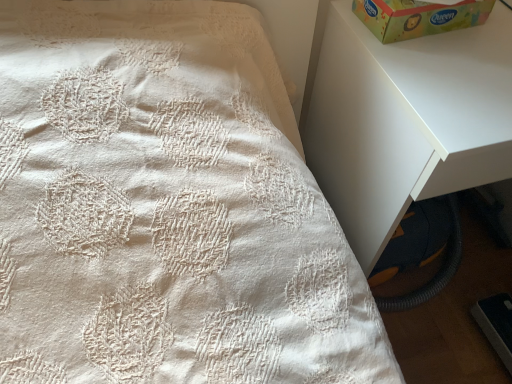
Question: Is green paperboard box at upper right with white matte nightstand at upper right?

Choices:
 (A) no
 (B) yes

Answer: (A)

Question: Is green paperboard box at upper right positioned beyond the bounds of white matte nightstand at upper right?

Choices:
 (A) no
 (B) yes

Answer: (B)

Question: From a real-world perspective, is green paperboard box at upper right located higher than white matte nightstand at upper right?

Choices:
 (A) no
 (B) yes

Answer: (B)

Question: Does green paperboard box at upper right appear on the right side of white matte nightstand at upper right?

Choices:
 (A) yes
 (B) no

Answer: (B)

Question: Considering the relative positions of green paperboard box at upper right and white matte nightstand at upper right in the image provided, is green paperboard box at upper right behind white matte nightstand at upper right?

Choices:
 (A) yes
 (B) no

Answer: (A)

Question: Does green paperboard box at upper right turn towards white matte nightstand at upper right?

Choices:
 (A) yes
 (B) no

Answer: (B)

Question: From the image's perspective, is white matte nightstand at upper right located beneath green paperboard box at upper right?

Choices:
 (A) no
 (B) yes

Answer: (B)

Question: Could you tell me if white matte nightstand at upper right is facing green paperboard box at upper right?

Choices:
 (A) no
 (B) yes

Answer: (A)

Question: Is white matte nightstand at upper right positioned with its back to green paperboard box at upper right?

Choices:
 (A) yes
 (B) no

Answer: (B)

Question: Is the surface of white matte nightstand at upper right in direct contact with green paperboard box at upper right?

Choices:
 (A) yes
 (B) no

Answer: (B)

Question: Is there a large distance between white matte nightstand at upper right and green paperboard box at upper right?

Choices:
 (A) yes
 (B) no

Answer: (B)

Question: Can we say white matte nightstand at upper right lies outside green paperboard box at upper right?

Choices:
 (A) yes
 (B) no

Answer: (A)

Question: Is point (501, 66) closer or farther from the camera than point (412, 1)?

Choices:
 (A) closer
 (B) farther

Answer: (B)